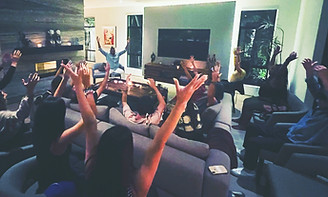
In order to click on phone in this screenshot , I will do `click(217, 173)`.